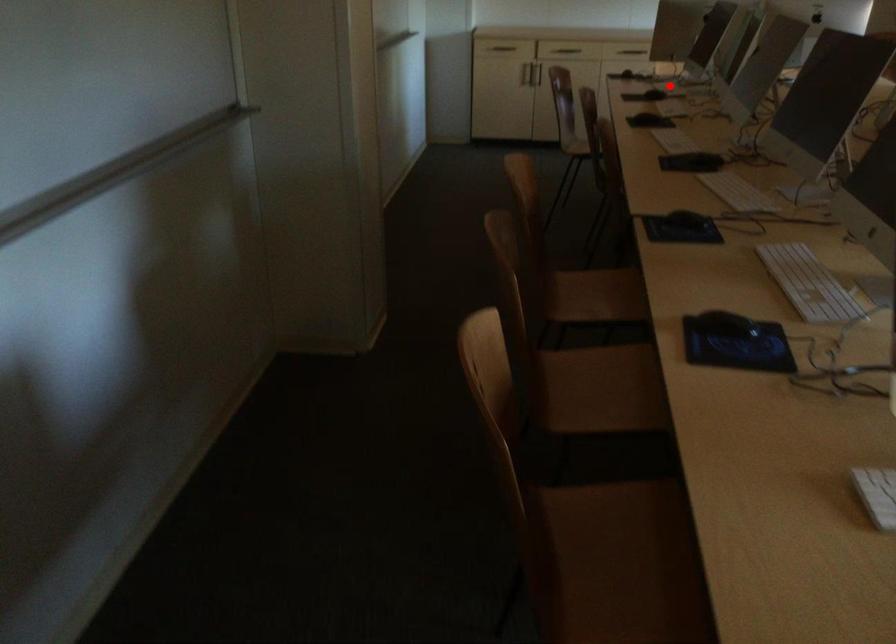
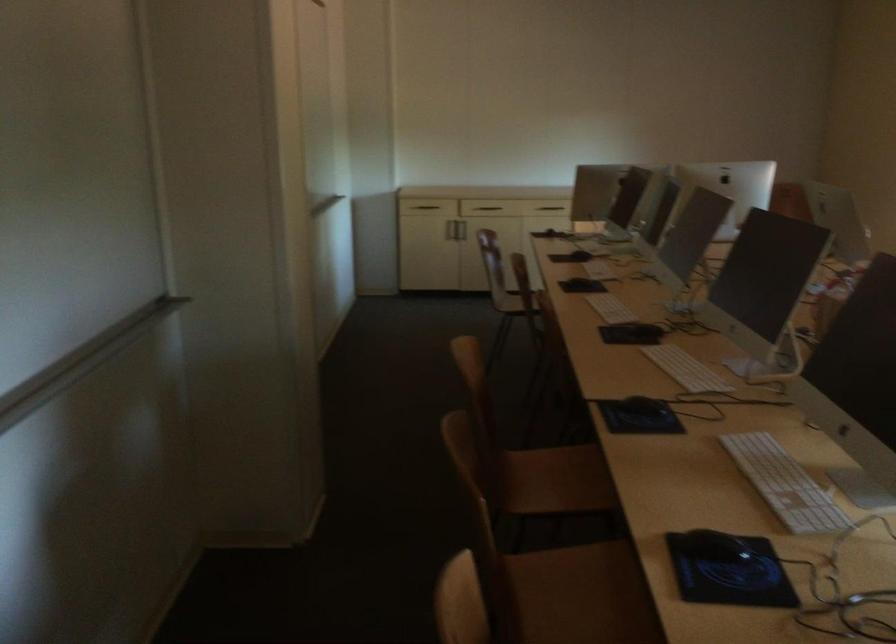
Where in the second image is the point corresponding to the highlighted location from the first image?

(593, 245)